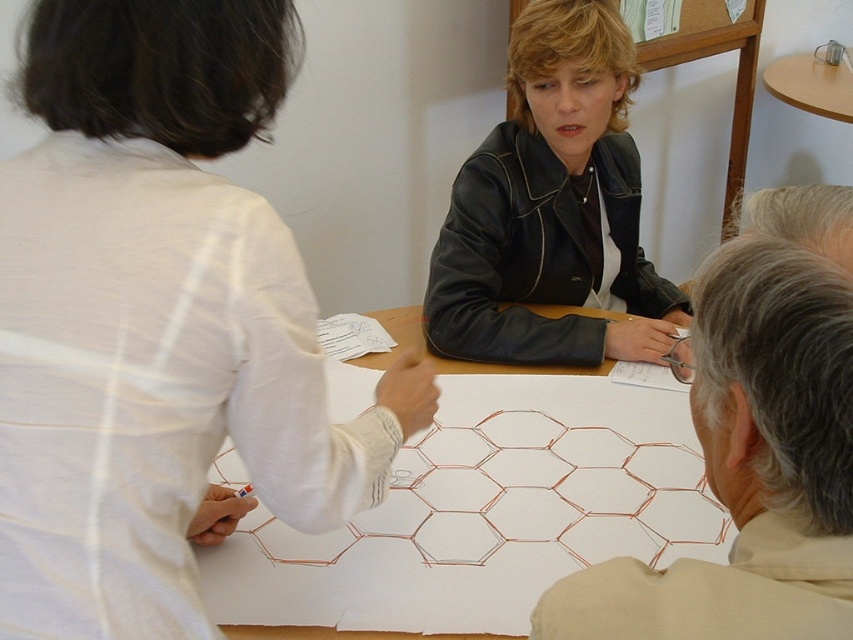
Question: Is gray hair at upper right closer to camera compared to black leather jacket at center?

Choices:
 (A) yes
 (B) no

Answer: (A)

Question: Which point is closer to the camera taking this photo?

Choices:
 (A) (512, 28)
 (B) (686, 444)
 (C) (792, 362)

Answer: (C)

Question: Among these objects, which one is farthest from the camera?

Choices:
 (A) white fabric shirt at upper left
 (B) gray hair at upper right
 (C) black leather jacket at center

Answer: (C)

Question: Can you confirm if white fabric shirt at upper left is bigger than black leather jacket at center?

Choices:
 (A) yes
 (B) no

Answer: (B)

Question: Among these points, which one is farthest from the camera?

Choices:
 (A) (616, 266)
 (B) (390, 611)

Answer: (A)

Question: Does white fabric shirt at upper left have a greater width compared to white paper at center?

Choices:
 (A) no
 (B) yes

Answer: (A)